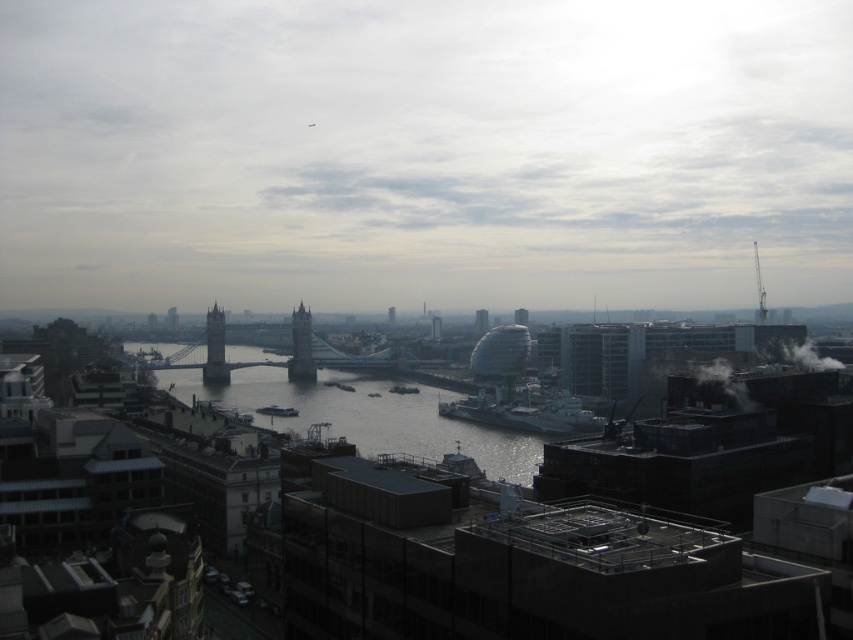
Question: Considering the real-world distances, which object is closest to the dark gray concrete river at center?

Choices:
 (A) dark gray stone tower bridge at center-left
 (B) dark gray stone tower at center

Answer: (B)

Question: Can you confirm if dark gray concrete river at center is positioned to the left of dark gray stone tower bridge at center-left?

Choices:
 (A) no
 (B) yes

Answer: (A)

Question: Does dark gray concrete river at center lie behind dark gray stone tower bridge at center-left?

Choices:
 (A) no
 (B) yes

Answer: (A)

Question: Among these objects, which one is nearest to the camera?

Choices:
 (A) dark gray stone tower at center
 (B) dark gray concrete river at center
 (C) dark gray stone tower bridge at center-left

Answer: (B)

Question: Among these objects, which one is nearest to the camera?

Choices:
 (A) dark gray concrete river at center
 (B) dark gray stone tower at center

Answer: (A)

Question: Is dark gray stone tower at center in front of dark gray stone tower bridge at center-left?

Choices:
 (A) yes
 (B) no

Answer: (A)